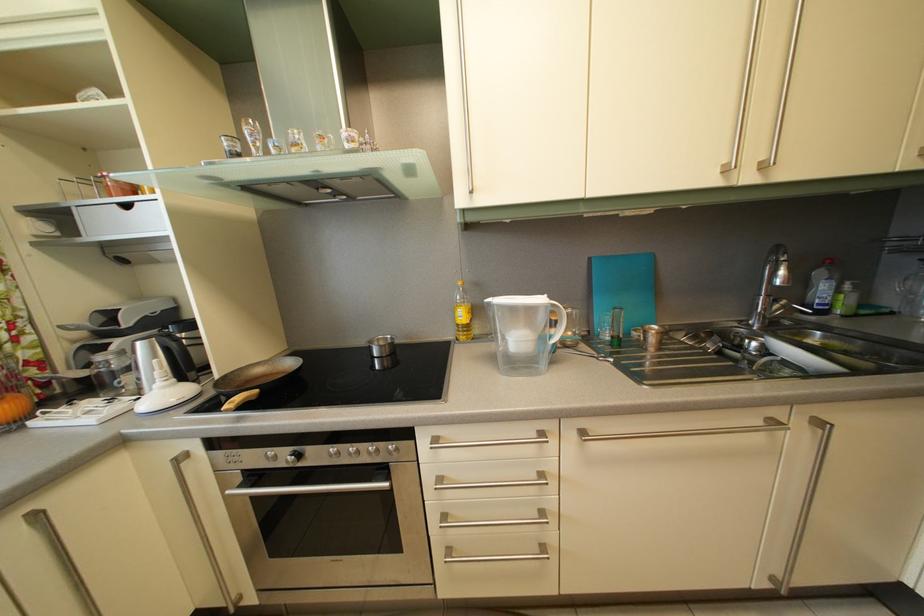
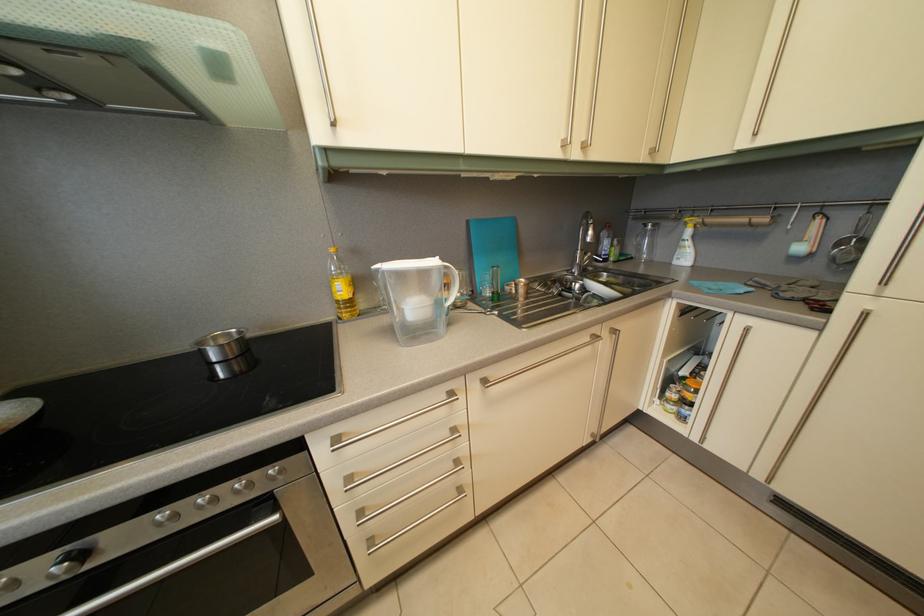
Where in the second image is the point corresponding to (x=538, y=438) from the first image?

(447, 402)